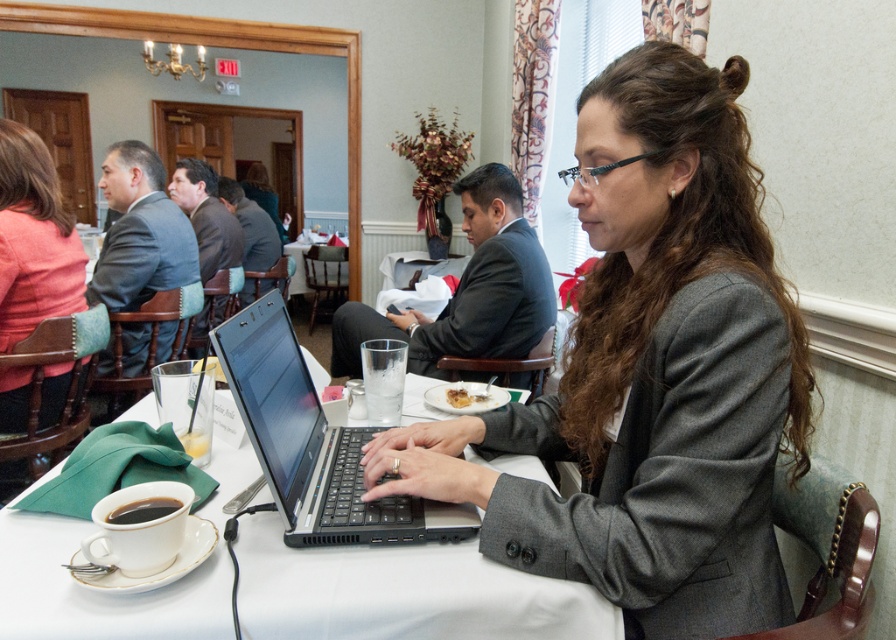
Question: Which object is farther from the camera taking this photo?

Choices:
 (A) gray wool blazer at center
 (B) black matte laptop at center
 (C) black matte cup at lower left

Answer: (C)

Question: Which is nearer to the matte black laptop at center?

Choices:
 (A) white glossy table at center
 (B) slightly browned bread at center

Answer: (A)

Question: Does black matte laptop at center have a smaller size compared to dark gray suit at center?

Choices:
 (A) no
 (B) yes

Answer: (B)

Question: Among these points, which one is farthest from the camera?

Choices:
 (A) (266, 188)
 (B) (448, 388)

Answer: (A)

Question: Can you confirm if white glossy table at center is positioned to the right of dark gray suit at center?

Choices:
 (A) yes
 (B) no

Answer: (B)

Question: Does matte black laptop at center appear on the right side of slightly browned bread at center?

Choices:
 (A) yes
 (B) no

Answer: (B)